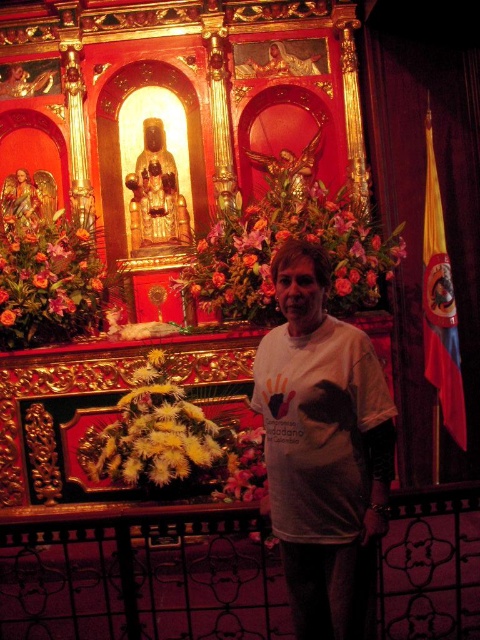
Can you confirm if white cotton t-shirt at center is taller than white fluffy flowers at lower left?

Incorrect, white cotton t-shirt at center's height is not larger of white fluffy flowers at lower left's.

Which is below, white cotton t-shirt at center or white fluffy flowers at lower left?

white cotton t-shirt at center is below.

Which is behind, point (363, 552) or point (181, 468)?

Positioned behind is point (181, 468).

The height and width of the screenshot is (640, 480). I want to click on white cotton t-shirt at center, so click(323, 449).

Identify the location of white cotton t-shirt at center. (323, 449).

Based on the photo, who is more forward, [266,236] or [2,316]?

Point [2,316]

Who is shorter, floral bouquet at center or orange floral bouquet at left?

floral bouquet at center

Is point (383, 262) positioned after point (26, 260)?

No, it is in front of (26, 260).

The image size is (480, 640). Find the location of `floral bouquet at center`. floral bouquet at center is located at coordinates (280, 243).